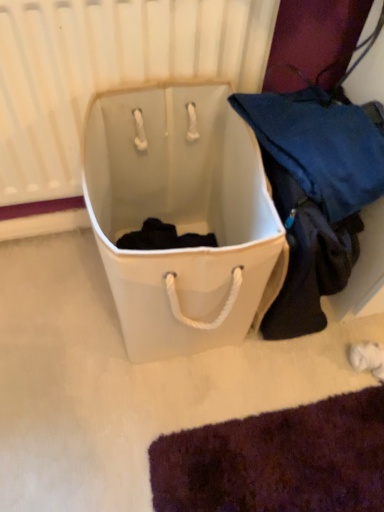
Question: Is point (228, 48) closer or farther from the camera than point (200, 210)?

Choices:
 (A) closer
 (B) farther

Answer: (A)

Question: Is white matte radiator at upper center bigger or smaller than white canvas laundry basket at center?

Choices:
 (A) big
 (B) small

Answer: (B)

Question: Relative to white canvas laundry basket at center, is white matte radiator at upper center in front or behind?

Choices:
 (A) behind
 (B) front

Answer: (A)

Question: Considering their positions, is white canvas laundry basket at center located in front of or behind white matte radiator at upper center?

Choices:
 (A) behind
 (B) front

Answer: (B)

Question: Based on their sizes in the image, would you say white canvas laundry basket at center is bigger or smaller than white matte radiator at upper center?

Choices:
 (A) big
 (B) small

Answer: (A)

Question: Is point (168, 326) positioned closer to the camera than point (168, 46)?

Choices:
 (A) farther
 (B) closer

Answer: (A)

Question: From their relative heights in the image, would you say white canvas laundry basket at center is taller or shorter than white matte radiator at upper center?

Choices:
 (A) tall
 (B) short

Answer: (B)